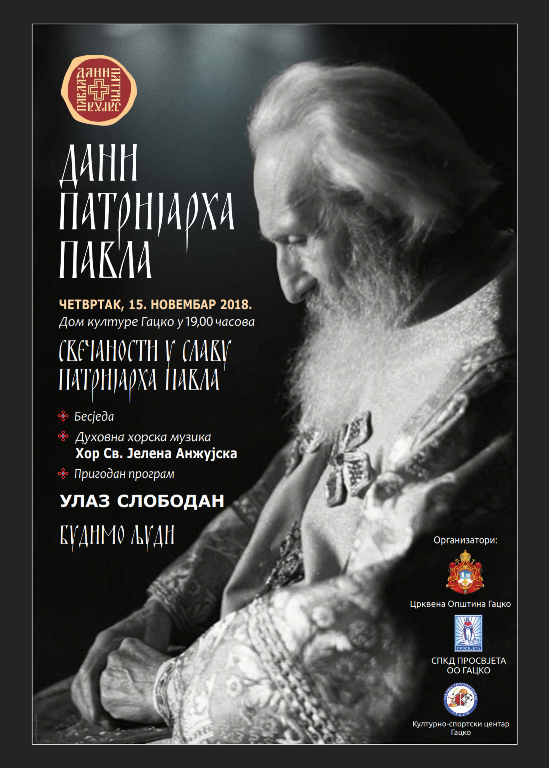
You are a GUI agent. You are given a task and a screenshot of the screen. Output one action in this format:
    pyautogui.click(x=<x>, y=<y>)
    Task: Click on the chest
    
    Given the screenshot: What is the action you would take?
    pyautogui.click(x=330, y=478)